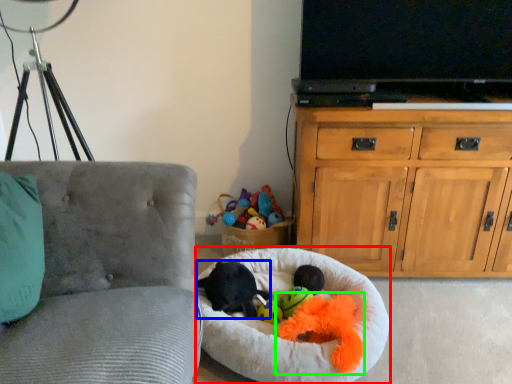
Question: Estimate the real-world distances between objects in this image. Which object is farther from dog bed (highlighted by a red box), animal (highlighted by a blue box) or toy (highlighted by a green box)?

Choices:
 (A) animal
 (B) toy

Answer: (A)